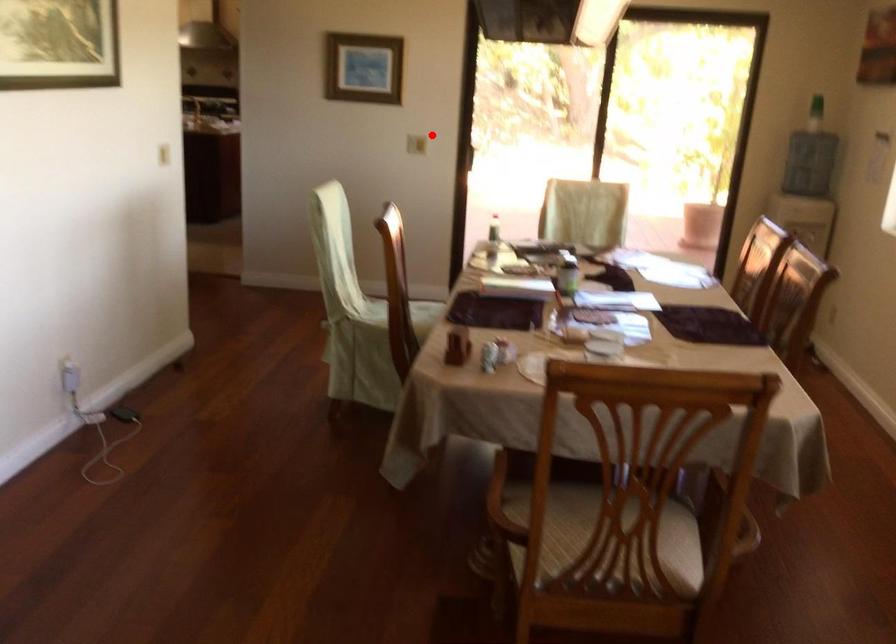
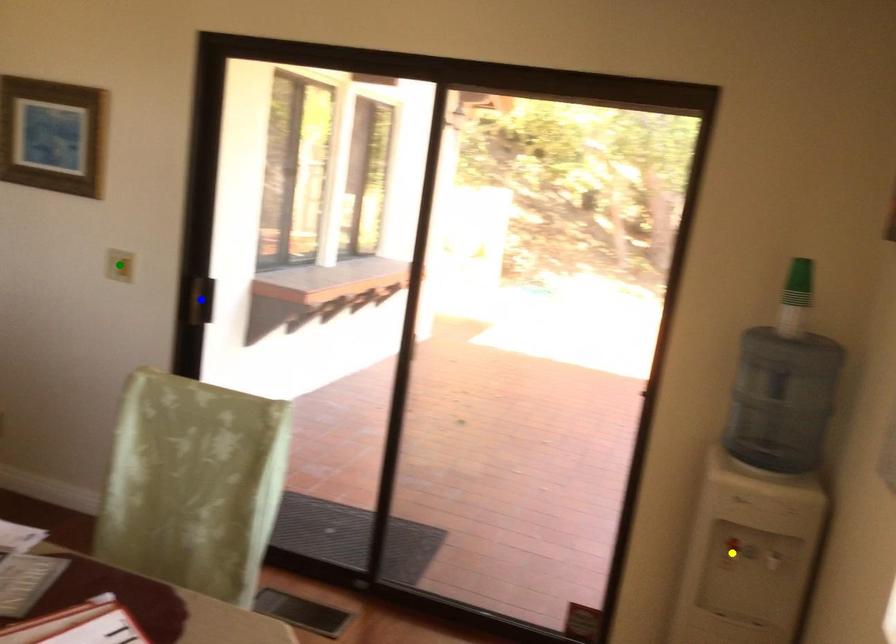
Question: I am providing you with two images of the same scene from different viewpoints. A red point is marked on the first image. You are given multiple points on the second image. Which spot in image 2 lines up with the point in image 1?

Choices:
 (A) green point
 (B) blue point
 (C) yellow point

Answer: (A)